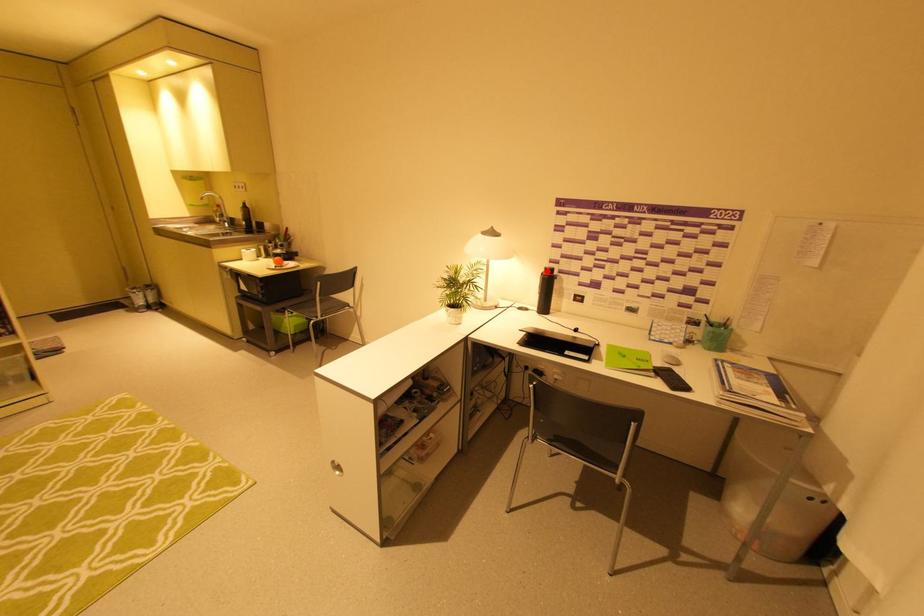
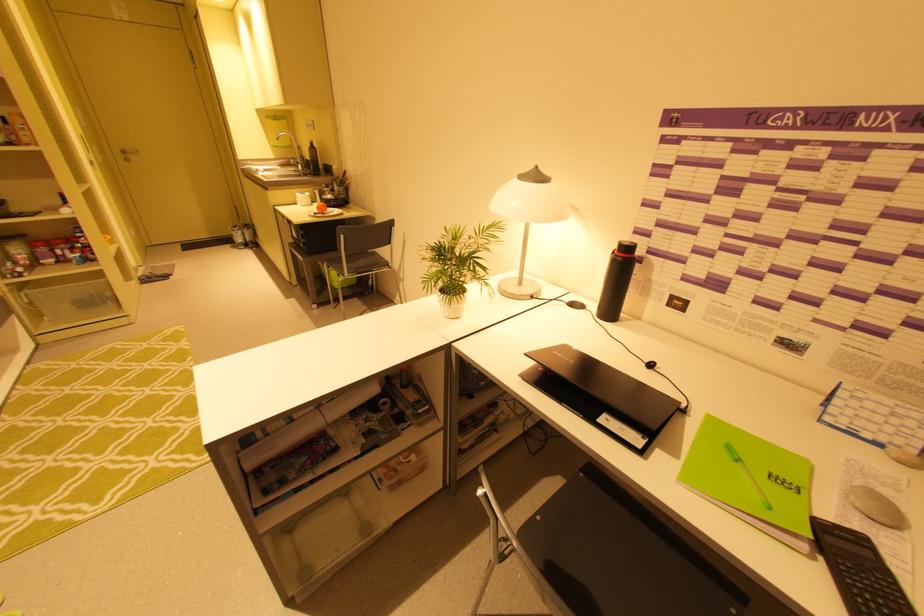
Question: I am providing you with two images of the same scene from different viewpoints. A red point is marked on the first image. Can you still see the location of the red point in image 2?

Choices:
 (A) Yes
 (B) No

Answer: (A)